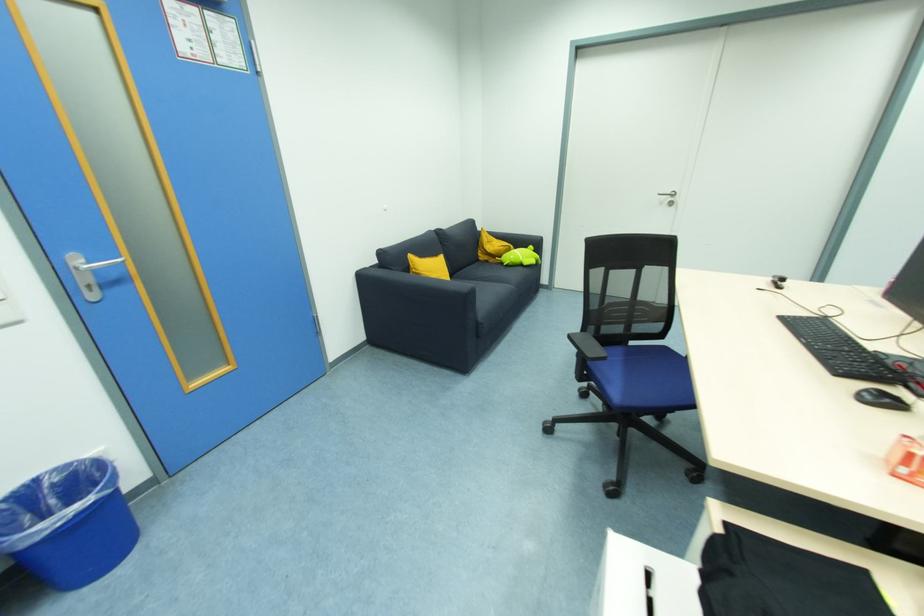
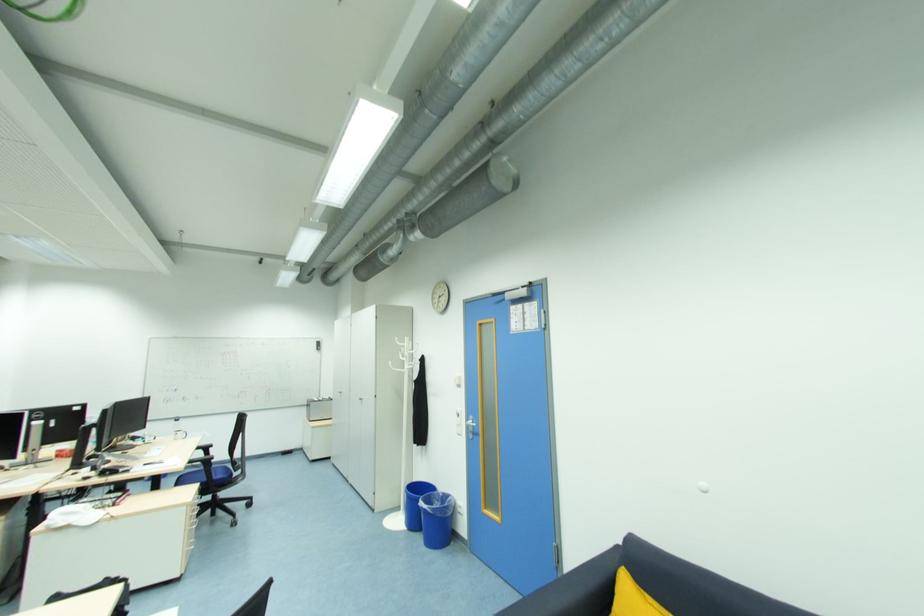
Locate, in the second image, the point that corresponds to [93,288] in the first image.

(473, 432)